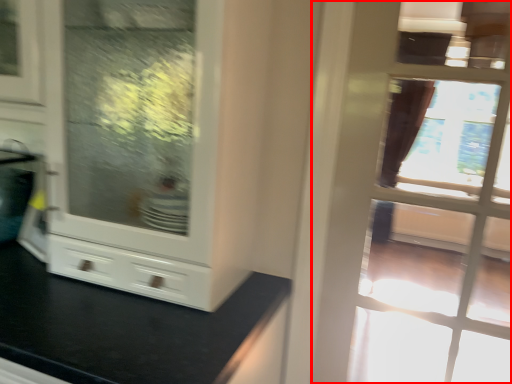
Question: From the image's perspective, what is the correct spatial positioning of door (annotated by the red box) in reference to cabinetry?

Choices:
 (A) below
 (B) above

Answer: (B)